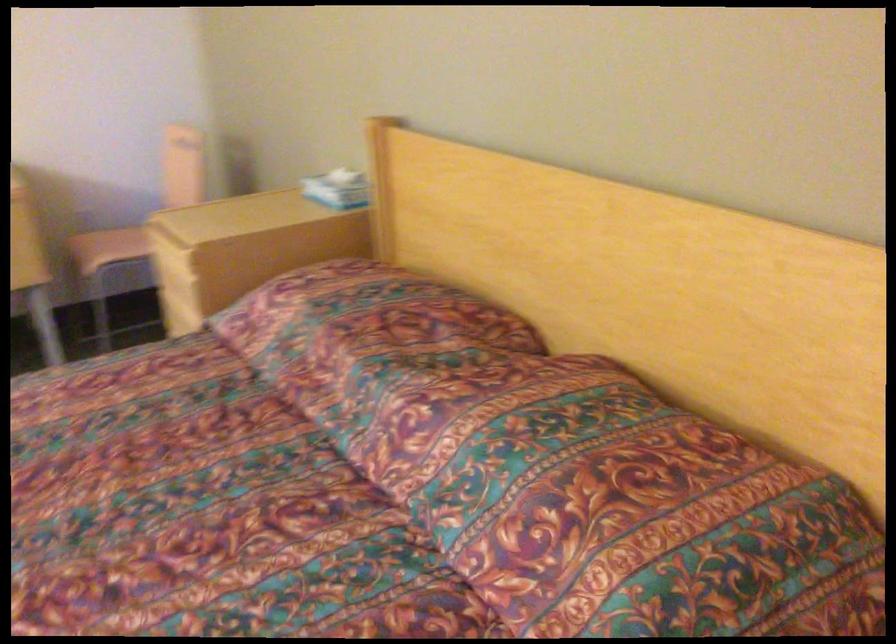
Where would you sit the chair sitting surface? Please return your answer as a coordinate pair (x, y).

(108, 247)